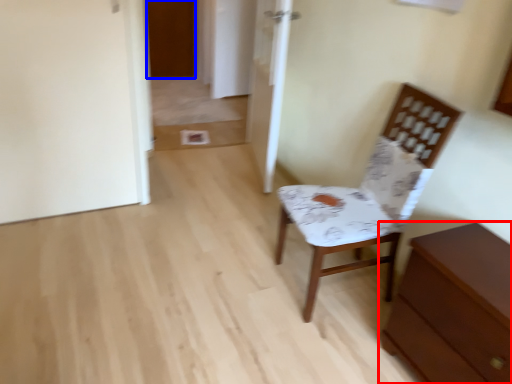
Question: Which object is closer to the camera taking this photo, chest of drawers (highlighted by a red box) or door (highlighted by a blue box)?

Choices:
 (A) chest of drawers
 (B) door

Answer: (A)